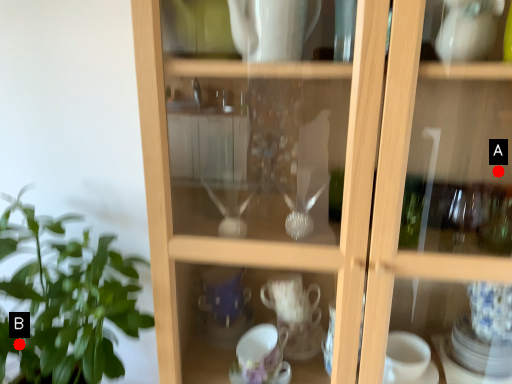
Question: Two points are circled on the image, labeled by A and B beside each circle. Which point is farther from the camera taking this photo?

Choices:
 (A) A is further
 (B) B is further

Answer: (A)